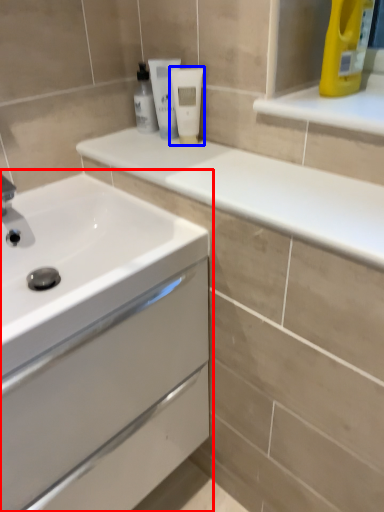
Question: Which object appears farthest to the camera in this image, bathroom cabinet (highlighted by a red box) or mouthwash (highlighted by a blue box)?

Choices:
 (A) bathroom cabinet
 (B) mouthwash

Answer: (B)